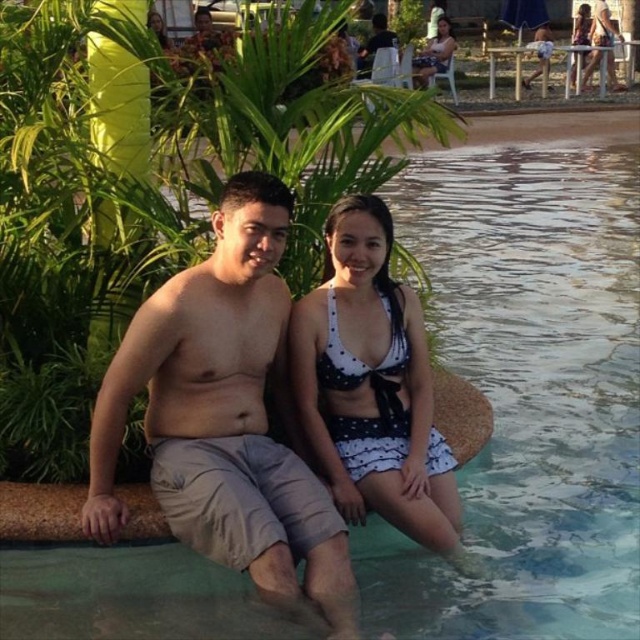
You are a photographer setting up a camera to capture the scene. You need to ensure that both the tan cotton shorts at center and the white polka dot bikini at upper right are clearly visible in the frame. Given that the camera has a fixed focal length, which object might require more careful positioning to avoid being obscured by other elements due to its size?

The tan cotton shorts at center might require more careful positioning because its width is less than the white polka dot bikini at upper right, making it smaller and potentially easier to be obscured if not framed properly.